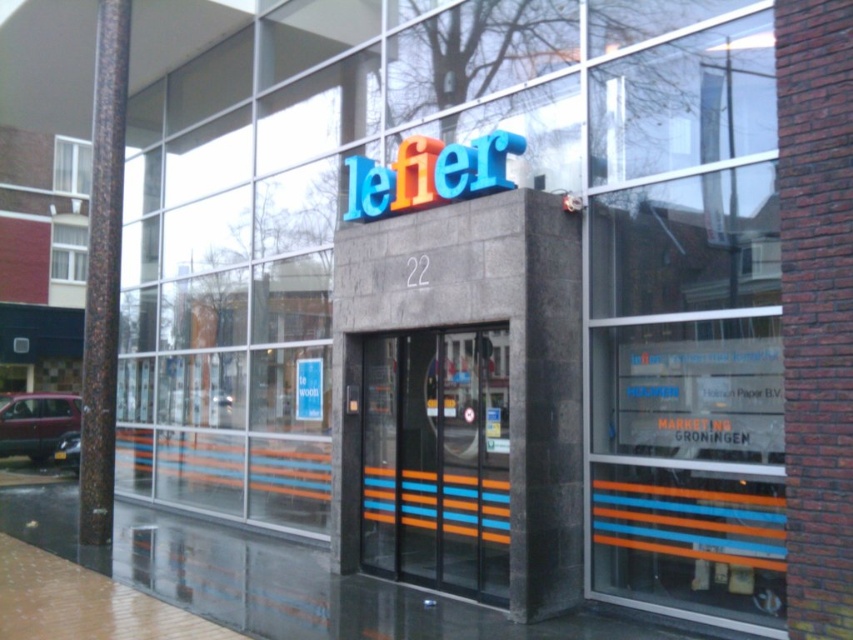
Which is more to the right, white plastic window at upper left or white fabric curtain at upper left?

white fabric curtain at upper left is more to the right.

Does white plastic window at upper left appear over white fabric curtain at upper left?

Yes, white plastic window at upper left is above white fabric curtain at upper left.

Is point (86, 148) positioned before point (51, 264)?

No, it is behind (51, 264).

At what (x,y) coordinates should I click in order to perform the action: click on white plastic window at upper left. Please return your answer as a coordinate pair (x, y). Looking at the image, I should click on (71, 164).

Between orange striped glass door at center and white fabric curtain at upper left, which one is positioned higher?

white fabric curtain at upper left is higher up.

I want to click on orange striped glass door at center, so click(436, 460).

Is transparent glass window at center smaller than white fabric curtain at upper left?

No, transparent glass window at center is not smaller than white fabric curtain at upper left.

Between transparent glass window at center and white fabric curtain at upper left, which one has more height?

transparent glass window at center

Where is `transparent glass window at center`? The width and height of the screenshot is (853, 640). transparent glass window at center is located at coordinates (683, 312).

Locate an element on the screen. The height and width of the screenshot is (640, 853). transparent glass window at center is located at coordinates (683, 312).